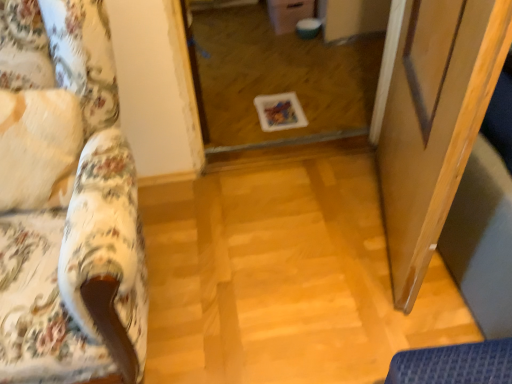
Question: Considering the relative sizes of transparent glass door at center and floral fabric couch at left in the image provided, is transparent glass door at center taller than floral fabric couch at left?

Choices:
 (A) no
 (B) yes

Answer: (A)

Question: Can you confirm if transparent glass door at center is smaller than floral fabric couch at left?

Choices:
 (A) no
 (B) yes

Answer: (B)

Question: Is transparent glass door at center located outside floral fabric couch at left?

Choices:
 (A) no
 (B) yes

Answer: (B)

Question: Is transparent glass door at center to the right of floral fabric couch at left from the viewer's perspective?

Choices:
 (A) yes
 (B) no

Answer: (A)

Question: Is transparent glass door at center facing away from floral fabric couch at left?

Choices:
 (A) yes
 (B) no

Answer: (B)

Question: Are transparent glass door at center and floral fabric couch at left making contact?

Choices:
 (A) yes
 (B) no

Answer: (B)

Question: From a real-world perspective, is transparent glass screen door at right located higher than floral fabric couch at left?

Choices:
 (A) yes
 (B) no

Answer: (B)

Question: Is there a large distance between transparent glass screen door at right and floral fabric couch at left?

Choices:
 (A) yes
 (B) no

Answer: (B)

Question: Does transparent glass screen door at right have a lesser width compared to floral fabric couch at left?

Choices:
 (A) no
 (B) yes

Answer: (B)

Question: Is transparent glass screen door at right in front of floral fabric couch at left?

Choices:
 (A) no
 (B) yes

Answer: (A)

Question: Does transparent glass screen door at right touch floral fabric couch at left?

Choices:
 (A) yes
 (B) no

Answer: (B)

Question: Can you confirm if transparent glass screen door at right is wider than floral fabric couch at left?

Choices:
 (A) no
 (B) yes

Answer: (A)

Question: From a real-world perspective, is floral fabric couch at left located higher than transparent glass screen door at right?

Choices:
 (A) yes
 (B) no

Answer: (A)